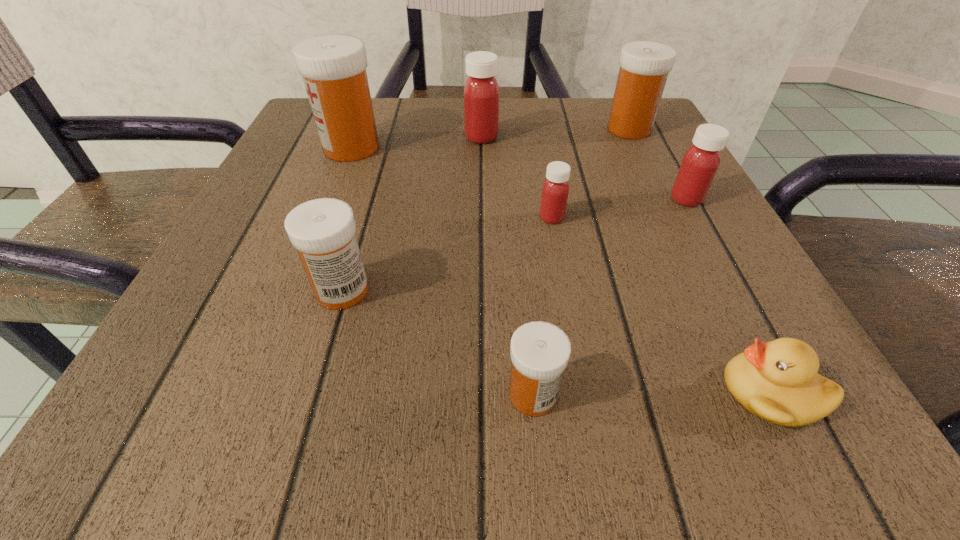
This screenshot has height=540, width=960. Find the location of `white medicine that is the fourth closest to the fourth farthest medicine`. white medicine that is the fourth closest to the fourth farthest medicine is located at coordinates (333, 67).

Locate which red medicine is the second closest to the second nearest white medicine. Please provide its 2D coordinates. Your answer should be formatted as a tuple, i.e. [(x, y)], where the tuple contains the x and y coordinates of a point satisfying the conditions above.

[(481, 91)]

The height and width of the screenshot is (540, 960). I want to click on red medicine identified as the second closest to the second smallest white medicine, so click(x=481, y=91).

Image resolution: width=960 pixels, height=540 pixels. In order to click on free spot that satisfies the following two spatial constraints: 1. on the front side of the second biggest red medicine; 2. on the front-facing side of the duckling in this screenshot , I will do `click(791, 392)`.

You are a GUI agent. You are given a task and a screenshot of the screen. Output one action in this format:
    pyautogui.click(x=<x>, y=<y>)
    Task: Click on the free space that satisfies the following two spatial constraints: 1. on the front side of the nearest white medicine; 2. on the right side of the leftmost red medicine
    Image resolution: width=960 pixels, height=540 pixels.
    Given the screenshot: What is the action you would take?
    (483, 394)

The height and width of the screenshot is (540, 960). In order to click on free location that satisfies the following two spatial constraints: 1. on the back side of the nearest medicine; 2. on the right side of the fourth object from right to left in this screenshot , I will do `click(516, 218)`.

Identify the location of free space that satisfies the following two spatial constraints: 1. on the back side of the third nearest object; 2. on the right side of the fifth nearest object. This screenshot has width=960, height=540. (369, 199).